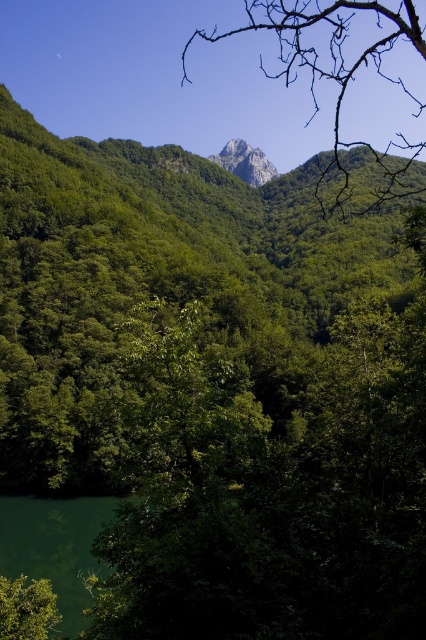
You are a hiker planning to take a photo of both the bare branches at upper center and the rugged granite peak at center. Which object should you position closer to the top of your camera frame?

The bare branches at upper center should be positioned closer to the top of your camera frame since it is much taller than the rugged granite peak at center.

You are an environmental scientist assessing the landscape. You notice the bare branches at upper center and the green liquid at lower left. Which object is taller in the scene?

The bare branches at upper center is taller than the green liquid at lower left according to the description.